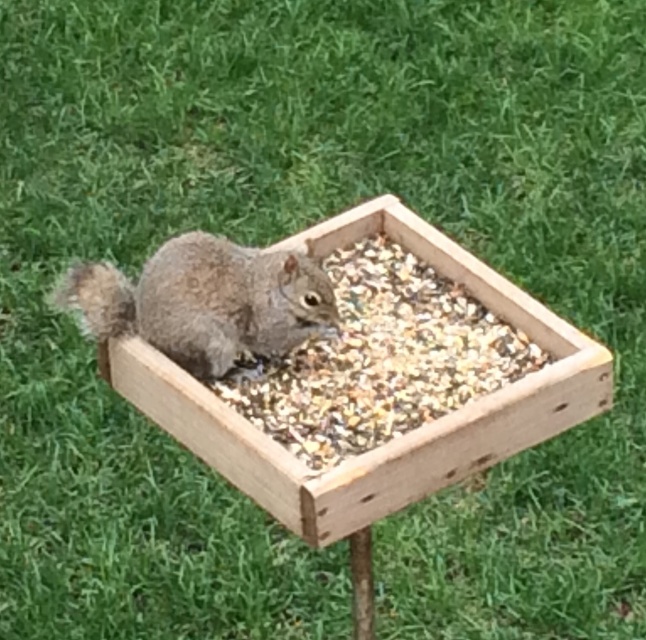
You are a bird trying to land on the bird feeder. You see the brown textured wood at center and the gray furry squirrel at center. Which object is closer to the ground?

The brown textured wood at center is located below the gray furry squirrel at center, so it is closer to the ground.

You are standing in front of the bird feeder and want to place a small treat at one of the two points marked in the image. Which point, point (311, 413) or point (171, 268), is closer to you?

Point (311, 413) is closer to the viewer than point (171, 268), so you should place the treat there if you want it to be closer to you.

Based on the photo, you are a bird trying to land on the bird feeder. The brown textured wood at center is part of the feeder, and there is a gray furry squirrel at center already eating. Considering their sizes, which object would you choose to land on for more space?

The brown textured wood at center has a larger size compared to the gray furry squirrel at center, so you should land on the brown textured wood at center for more space.